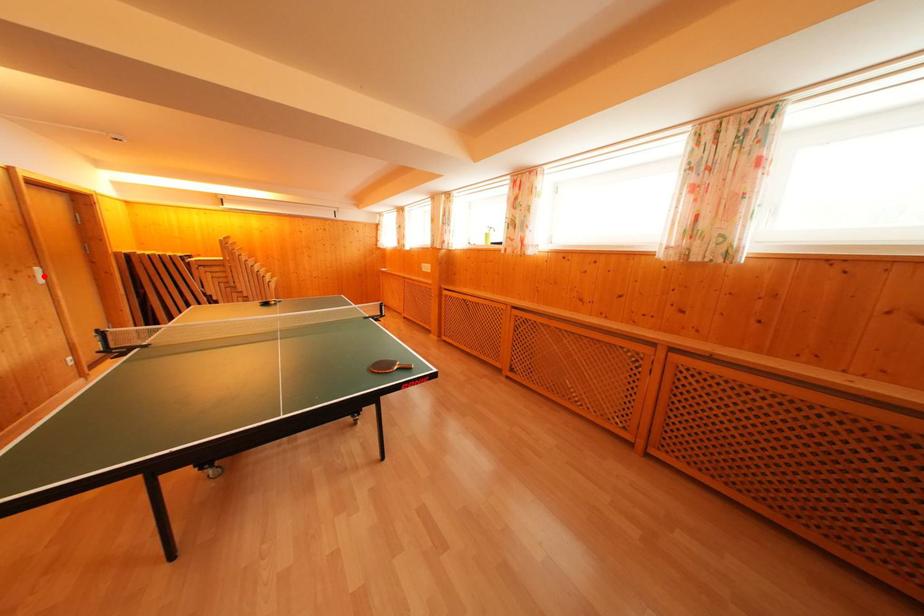
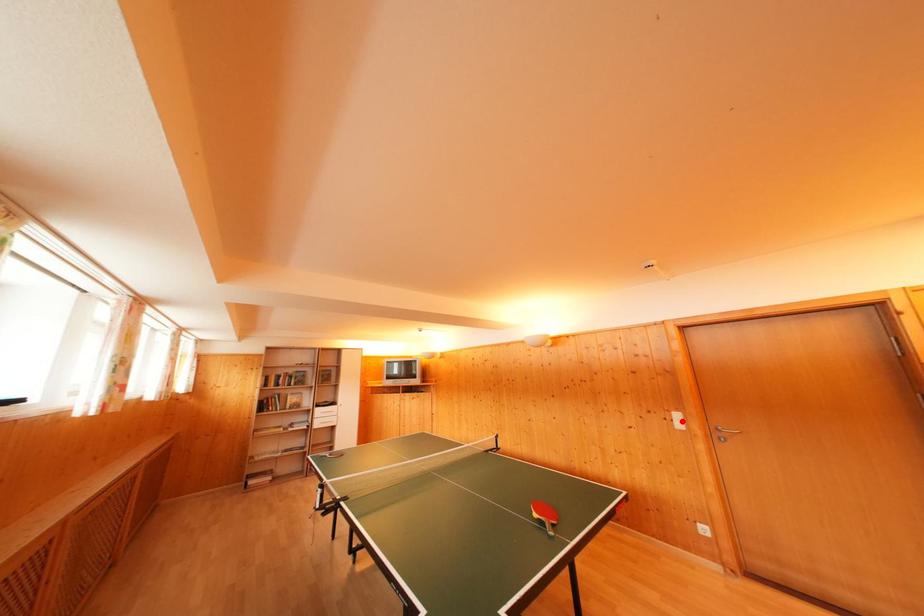
I am providing you with two images of the same scene from different viewpoints. A red point is marked on the first image and another point is marked on the second image. Is the marked point in image1 the same physical position as the marked point in image2?

Yes